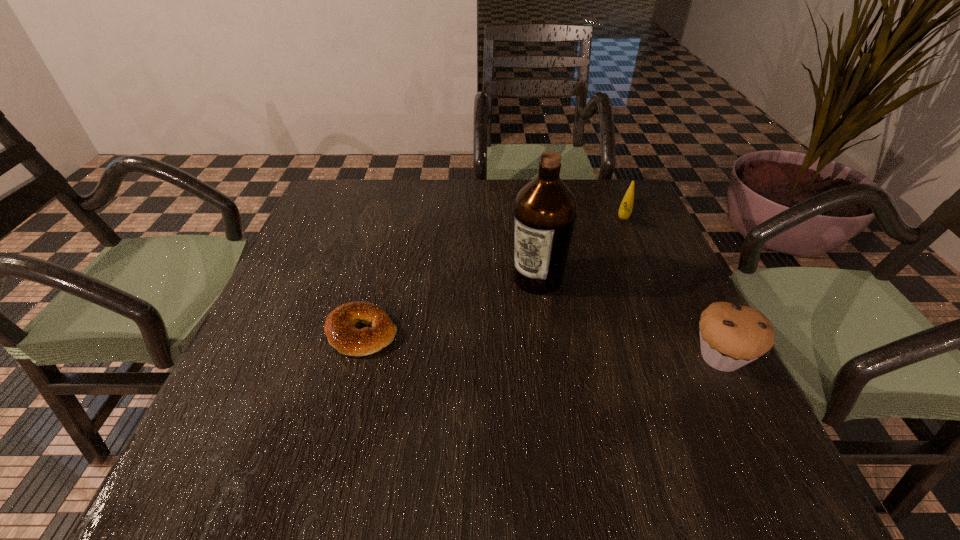
I want to click on bagel, so click(340, 329).

I want to click on the leftmost object, so click(x=340, y=329).

Image resolution: width=960 pixels, height=540 pixels. I want to click on the third shortest object, so click(731, 335).

Locate an element on the screen. This screenshot has width=960, height=540. banana is located at coordinates (625, 210).

Locate an element on the screen. the second shortest object is located at coordinates coord(625,210).

Where is `the tallest object`? The height and width of the screenshot is (540, 960). the tallest object is located at coordinates (545, 210).

This screenshot has height=540, width=960. Find the location of `the second farthest object`. the second farthest object is located at coordinates (545, 210).

Where is `vacant area situated on the back of the bagel`? The image size is (960, 540). vacant area situated on the back of the bagel is located at coordinates (380, 264).

Locate an element on the screen. The image size is (960, 540). free location located on the left of the muffin is located at coordinates (621, 357).

Where is `free point located 0.120m at the stem of the banana`? free point located 0.120m at the stem of the banana is located at coordinates (x=618, y=259).